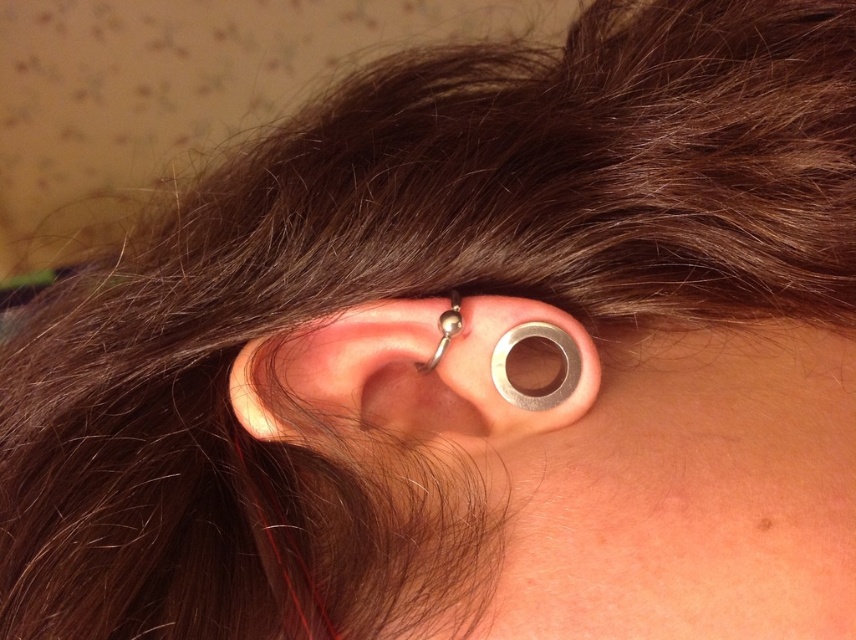
Question: Does silver metallic ring at center appear over polished silver ball at center?

Choices:
 (A) yes
 (B) no

Answer: (B)

Question: Can you confirm if silver metallic ring at center is bigger than polished silver ball at center?

Choices:
 (A) no
 (B) yes

Answer: (B)

Question: Which object is farther from the camera taking this photo?

Choices:
 (A) silver metallic ring at center
 (B) polished silver ball at center

Answer: (B)

Question: Which point appears closest to the camera in this image?

Choices:
 (A) (317, 404)
 (B) (447, 340)

Answer: (B)

Question: Among these objects, which one is nearest to the camera?

Choices:
 (A) polished silver ball at center
 (B) silver metallic ring at center

Answer: (B)

Question: Is silver metallic ring at center positioned at the back of polished silver ball at center?

Choices:
 (A) no
 (B) yes

Answer: (A)